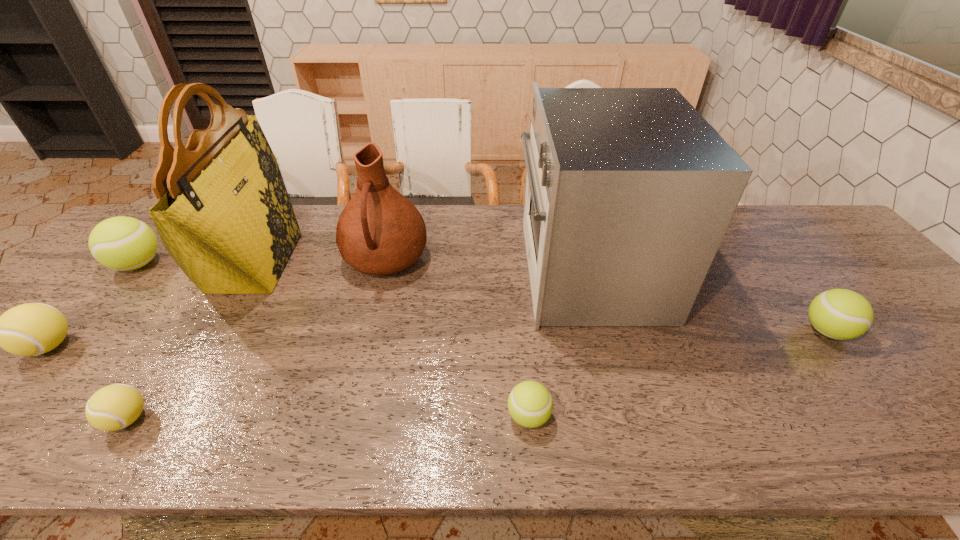
You are a GUI agent. You are given a task and a screenshot of the screen. Output one action in this format:
    pyautogui.click(x=<x>, y=<y>)
    Task: Click on the vacant space at the near edge
    The width and height of the screenshot is (960, 540).
    Given the screenshot: What is the action you would take?
    pyautogui.click(x=743, y=421)

Locate an element on the screen. The width and height of the screenshot is (960, 540). vacant region at the left edge of the desktop is located at coordinates (151, 266).

Locate an element on the screen. The image size is (960, 540). free space at the right edge of the desktop is located at coordinates (949, 363).

In the image, there is a desktop. Where is `vacant space at the far right corner`? vacant space at the far right corner is located at coordinates (814, 247).

Image resolution: width=960 pixels, height=540 pixels. Identify the location of vacant region between the second nearest green tennis ball and the farthest green tennis ball. (483, 298).

Image resolution: width=960 pixels, height=540 pixels. I want to click on free space that is in between the tote bag and the bigger yellow tennis ball, so click(153, 304).

This screenshot has height=540, width=960. I want to click on free space between the left yellow tennis ball and the nearest green tennis ball, so click(289, 381).

At what (x,y) coordinates should I click in order to perform the action: click on free space between the nearest green tennis ball and the third tallest object. Please return your answer as a coordinate pair (x, y). This screenshot has width=960, height=540. Looking at the image, I should click on (457, 338).

At what (x,y) coordinates should I click in order to perform the action: click on free space between the toaster oven and the tote bag. Please return your answer as a coordinate pair (x, y). This screenshot has width=960, height=540. Looking at the image, I should click on (422, 266).

Where is `free area in between the nearest green tennis ball and the pitcher`? This screenshot has width=960, height=540. free area in between the nearest green tennis ball and the pitcher is located at coordinates (457, 338).